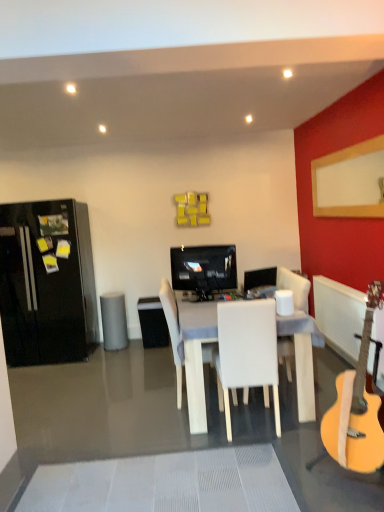
Question: Can you confirm if gray matte trash bin/can at center is positioned to the left of matte black television at center?

Choices:
 (A) no
 (B) yes

Answer: (B)

Question: Is gray matte trash bin/can at center facing towards matte black television at center?

Choices:
 (A) yes
 (B) no

Answer: (B)

Question: Does gray matte trash bin/can at center come in front of matte black television at center?

Choices:
 (A) no
 (B) yes

Answer: (A)

Question: From a real-world perspective, is gray matte trash bin/can at center positioned under matte black television at center based on gravity?

Choices:
 (A) yes
 (B) no

Answer: (A)

Question: Is gray matte trash bin/can at center bigger than matte black television at center?

Choices:
 (A) yes
 (B) no

Answer: (A)

Question: Is satin black monitor at center taller or shorter than black glossy refrigerator at left?

Choices:
 (A) short
 (B) tall

Answer: (A)

Question: From a real-world perspective, relative to black glossy refrigerator at left, is satin black monitor at center vertically above or below?

Choices:
 (A) below
 (B) above

Answer: (A)

Question: Would you say satin black monitor at center is inside or outside black glossy refrigerator at left?

Choices:
 (A) outside
 (B) inside

Answer: (A)

Question: Considering the positions of satin black monitor at center and black glossy refrigerator at left in the image, is satin black monitor at center wider or thinner than black glossy refrigerator at left?

Choices:
 (A) thin
 (B) wide

Answer: (A)

Question: From the image's perspective, relative to white plastic radiator at right, is gray matte trash bin/can at center above or below?

Choices:
 (A) above
 (B) below

Answer: (B)

Question: Is point (107, 301) closer or farther from the camera than point (337, 329)?

Choices:
 (A) closer
 (B) farther

Answer: (B)

Question: From a real-world perspective, is gray matte trash bin/can at center above or below white plastic radiator at right?

Choices:
 (A) above
 (B) below

Answer: (B)

Question: Considering the positions of gray matte trash bin/can at center and white plastic radiator at right in the image, is gray matte trash bin/can at center bigger or smaller than white plastic radiator at right?

Choices:
 (A) big
 (B) small

Answer: (B)

Question: Relative to white matte chair at center, which ranks as the first chair in front-to-back order, is gray matte trash bin/can at center in front or behind?

Choices:
 (A) front
 (B) behind

Answer: (B)

Question: From the image's perspective, is gray matte trash bin/can at center positioned above or below white matte chair at center, which ranks as the first chair in front-to-back order?

Choices:
 (A) below
 (B) above

Answer: (A)